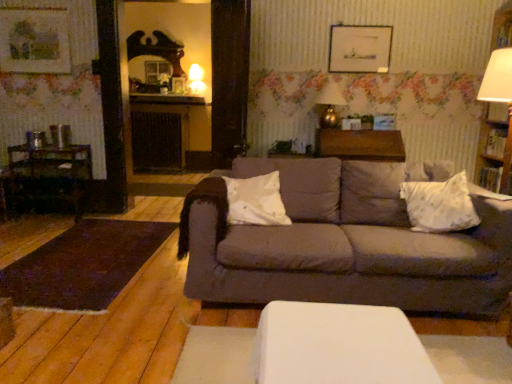
Question: Are matte gray couch at center and wooden dark chair at left making contact?

Choices:
 (A) no
 (B) yes

Answer: (A)

Question: Is matte gray couch at center aimed at wooden dark chair at left?

Choices:
 (A) no
 (B) yes

Answer: (A)

Question: Is matte gray couch at center closer to camera compared to wooden dark chair at left?

Choices:
 (A) no
 (B) yes

Answer: (B)

Question: From a real-world perspective, does matte gray couch at center sit lower than wooden dark chair at left?

Choices:
 (A) no
 (B) yes

Answer: (A)

Question: Is matte gray couch at center at the right side of wooden dark chair at left?

Choices:
 (A) no
 (B) yes

Answer: (B)

Question: Is point (498, 150) closer or farther from the camera than point (320, 102)?

Choices:
 (A) closer
 (B) farther

Answer: (A)

Question: Is wooden bookshelf at right in front of or behind matte gold table lamp at upper center, the first table lamp from the bottom, in the image?

Choices:
 (A) behind
 (B) front

Answer: (B)

Question: Considering the positions of wooden bookshelf at right and matte gold table lamp at upper center, acting as the first table lamp starting from the front, in the image, is wooden bookshelf at right wider or thinner than matte gold table lamp at upper center, acting as the first table lamp starting from the front,?

Choices:
 (A) thin
 (B) wide

Answer: (A)

Question: Is wooden bookshelf at right to the left or to the right of matte gold table lamp at upper center, which is the 1th table lamp in right-to-left order, in the image?

Choices:
 (A) left
 (B) right

Answer: (B)

Question: Is matte gold table lamp at upper center, which appears as the 2th table lamp when viewed from the back, wider or thinner than wooden dark chair at left?

Choices:
 (A) wide
 (B) thin

Answer: (B)

Question: Would you say matte gold table lamp at upper center, the 2th table lamp when ordered from left to right, is inside or outside wooden dark chair at left?

Choices:
 (A) outside
 (B) inside

Answer: (A)

Question: From the image's perspective, relative to wooden dark chair at left, is matte gold table lamp at upper center, the 2th table lamp when ordered from left to right, above or below?

Choices:
 (A) above
 (B) below

Answer: (A)

Question: Is matte gold table lamp at upper center, the first table lamp from the bottom, to the left or to the right of wooden dark chair at left in the image?

Choices:
 (A) left
 (B) right

Answer: (B)

Question: From the image's perspective, is white textured pillow at right above or below wooden picture frame at upper center, which appears as the 2th picture frame when viewed from the left?

Choices:
 (A) above
 (B) below

Answer: (B)

Question: Which is correct: white textured pillow at right is inside wooden picture frame at upper center, which appears as the first picture frame when viewed from the right, or outside of it?

Choices:
 (A) inside
 (B) outside

Answer: (B)